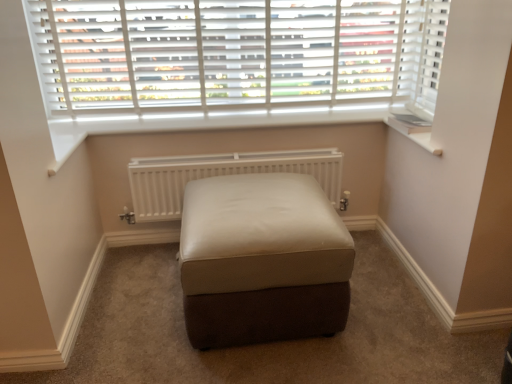
Question: Is white matte radiator at center positioned with its back to leather ottoman at center?

Choices:
 (A) yes
 (B) no

Answer: (B)

Question: Can you confirm if white matte radiator at center is thinner than leather ottoman at center?

Choices:
 (A) no
 (B) yes

Answer: (B)

Question: Does white matte radiator at center lie behind leather ottoman at center?

Choices:
 (A) yes
 (B) no

Answer: (A)

Question: From the image's perspective, is white matte radiator at center on leather ottoman at center?

Choices:
 (A) no
 (B) yes

Answer: (B)

Question: From a real-world perspective, does white matte radiator at center stand above leather ottoman at center?

Choices:
 (A) yes
 (B) no

Answer: (A)

Question: From the image's perspective, is white matte radiator at center positioned above or below leather ottoman at center?

Choices:
 (A) below
 (B) above

Answer: (B)

Question: Considering the positions of white matte radiator at center and leather ottoman at center in the image, is white matte radiator at center wider or thinner than leather ottoman at center?

Choices:
 (A) thin
 (B) wide

Answer: (A)

Question: From a real-world perspective, is white matte radiator at center physically located above or below leather ottoman at center?

Choices:
 (A) above
 (B) below

Answer: (A)

Question: Considering the positions of white matte radiator at center and leather ottoman at center in the image, is white matte radiator at center bigger or smaller than leather ottoman at center?

Choices:
 (A) small
 (B) big

Answer: (A)

Question: Relative to white plastic window sill at upper right, is leather ottoman at center in front or behind?

Choices:
 (A) behind
 (B) front

Answer: (B)

Question: In the image, is leather ottoman at center on the left side or the right side of white plastic window sill at upper right?

Choices:
 (A) right
 (B) left

Answer: (B)

Question: Do you think leather ottoman at center is within white plastic window sill at upper right, or outside of it?

Choices:
 (A) inside
 (B) outside

Answer: (B)

Question: In terms of size, does leather ottoman at center appear bigger or smaller than white plastic window sill at upper right?

Choices:
 (A) small
 (B) big

Answer: (B)

Question: Is leather ottoman at center spatially inside white matte radiator at center, or outside of it?

Choices:
 (A) outside
 (B) inside

Answer: (A)

Question: Is point (328, 226) closer or farther from the camera than point (181, 195)?

Choices:
 (A) closer
 (B) farther

Answer: (A)